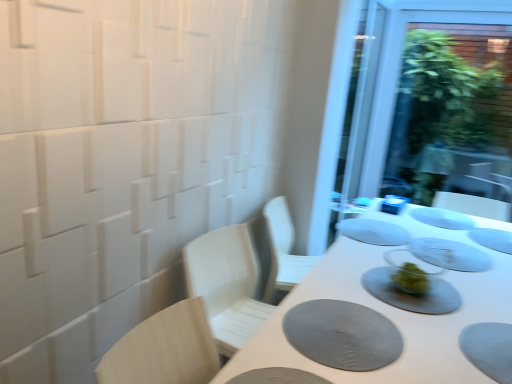
Question: Considering their positions, is transparent glass screen door at upper right located in front of or behind white matte table at center?

Choices:
 (A) front
 (B) behind

Answer: (B)

Question: Is transparent glass screen door at upper right to the left or to the right of white matte table at center in the image?

Choices:
 (A) left
 (B) right

Answer: (B)

Question: Which of these objects is positioned farthest from the white matte table at center?

Choices:
 (A) white matte plate at center, arranged as the 2th tableware when viewed from the back
 (B) gray matte placemat at center, which is the 4th tableware in back-to-front order
 (C) blue plastic container at center, which ranks as the 1th tableware in back-to-front order
 (D) light wood chair at left
 (E) matte gray placemat at center, which is counted as the sixth tableware, starting from the back

Answer: (C)

Question: Estimate the real-world distances between objects in this image. Which object is closer to the blue plastic container at center, which ranks as the 1th tableware in back-to-front order?

Choices:
 (A) white matte plate at center, arranged as the 2th tableware when viewed from the back
 (B) white matte table at center
 (C) light wood chair at left
 (D) clear glass plate at center, which is the 2th tableware from front to back
 (E) transparent glass screen door at upper right

Answer: (A)